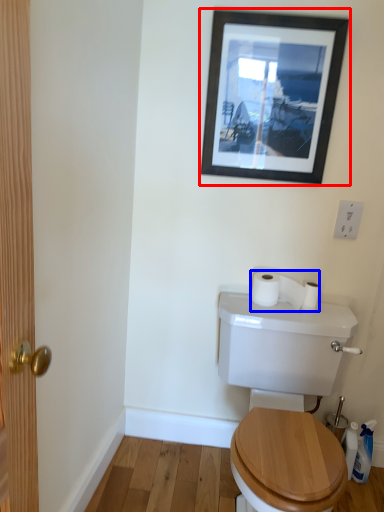
Question: Which object is closer to the camera taking this photo, picture frame (highlighted by a red box) or toilet paper (highlighted by a blue box)?

Choices:
 (A) picture frame
 (B) toilet paper

Answer: (A)